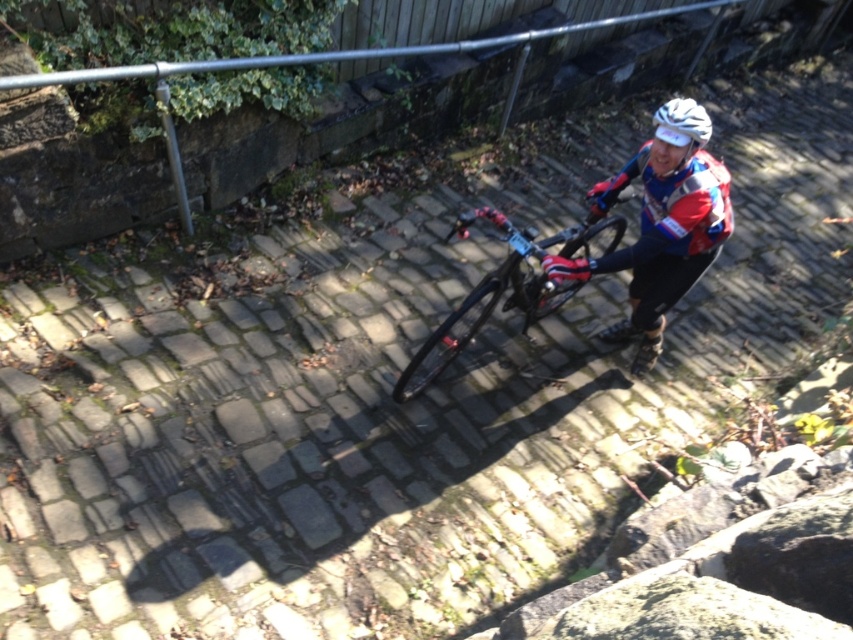
Does red and white jersey at center have a larger size compared to white matte bicycle helmet at upper center?

Correct, red and white jersey at center is larger in size than white matte bicycle helmet at upper center.

Which is behind, point (701, 129) or point (708, 124)?

The point (708, 124) is more distant.

Image resolution: width=853 pixels, height=640 pixels. I want to click on red and white jersey at center, so click(x=660, y=225).

What do you see at coordinates (598, 257) in the screenshot?
I see `shiny blue jersey at center` at bounding box center [598, 257].

Is shiny blue jersey at center above red and white jersey at center?

Yes, shiny blue jersey at center is above red and white jersey at center.

Is point (648, 166) farther from camera compared to point (680, 280)?

No.

Where is `shiny blue jersey at center`? Image resolution: width=853 pixels, height=640 pixels. shiny blue jersey at center is located at coordinates (598, 257).

Is shiny blue jersey at center positioned at the back of shiny black frame at center?

No.

Who is more distant from viewer, (668,200) or (444,365)?

Positioned behind is point (444,365).

The image size is (853, 640). Find the location of `shiny blue jersey at center`. shiny blue jersey at center is located at coordinates (598, 257).